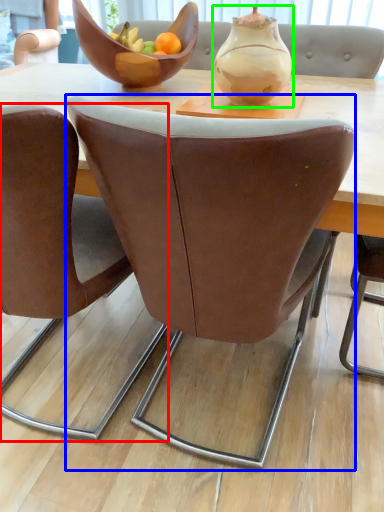
Question: Estimate the real-world distances between objects in this image. Which object is farther from chair (highlighted by a red box), chair (highlighted by a blue box) or vase (highlighted by a green box)?

Choices:
 (A) chair
 (B) vase

Answer: (B)